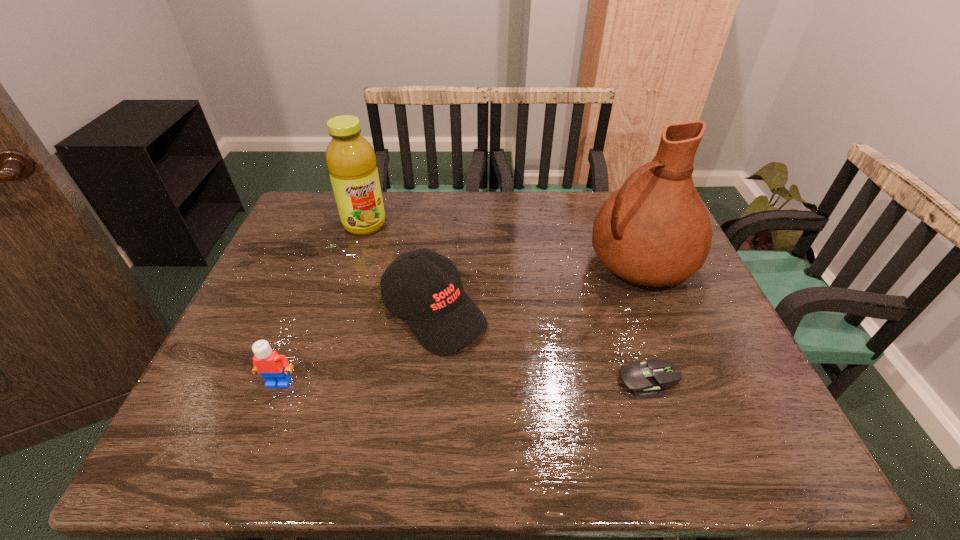
Image resolution: width=960 pixels, height=540 pixels. Identify the location of vacant space that is in between the pitcher and the shortest object. (644, 322).

Where is `empty space that is in between the tallest object and the fruit juice`? Image resolution: width=960 pixels, height=540 pixels. empty space that is in between the tallest object and the fruit juice is located at coordinates (503, 245).

The width and height of the screenshot is (960, 540). In order to click on free space that is in between the computer mouse and the pitcher in this screenshot , I will do point(644,322).

Identify the location of vacant space that's between the pitcher and the second tallest object. Image resolution: width=960 pixels, height=540 pixels. (503, 245).

Identify which object is located as the fourth nearest to the third object from left to right. Please provide its 2D coordinates. Your answer should be formatted as a tuple, i.e. [(x, y)], where the tuple contains the x and y coordinates of a point satisfying the conditions above.

[(655, 230)]

Identify which object is the closest to the tallest object. Please provide its 2D coordinates. Your answer should be formatted as a tuple, i.e. [(x, y)], where the tuple contains the x and y coordinates of a point satisfying the conditions above.

[(647, 380)]

Image resolution: width=960 pixels, height=540 pixels. In order to click on free spot that satisfies the following two spatial constraints: 1. on the back side of the third object from left to right; 2. on the right side of the tallest object in this screenshot , I will do `click(440, 264)`.